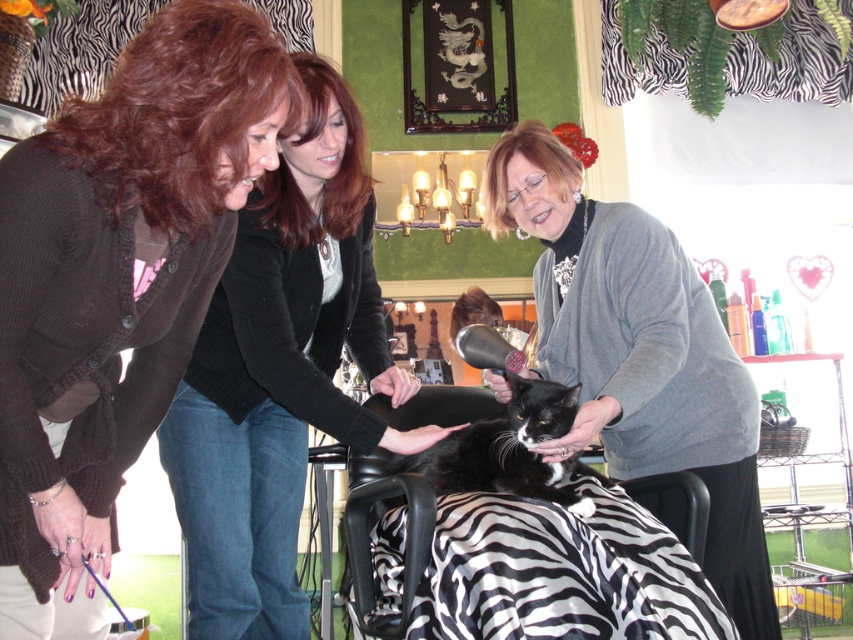
You are standing in the pet grooming salon and need to place a new decorative item on the gray sweater at center. Where exactly should you place it?

The gray sweater at center is located at point (637,353), so you should place the new decorative item at those coordinates.

You are a customer entering the pet grooming salon and see the image. You want to know which item is larger between the matte brown sweater at center and the brown wavy hair at upper left. Can you tell me?

The matte brown sweater at center is bigger than the brown wavy hair at upper left.